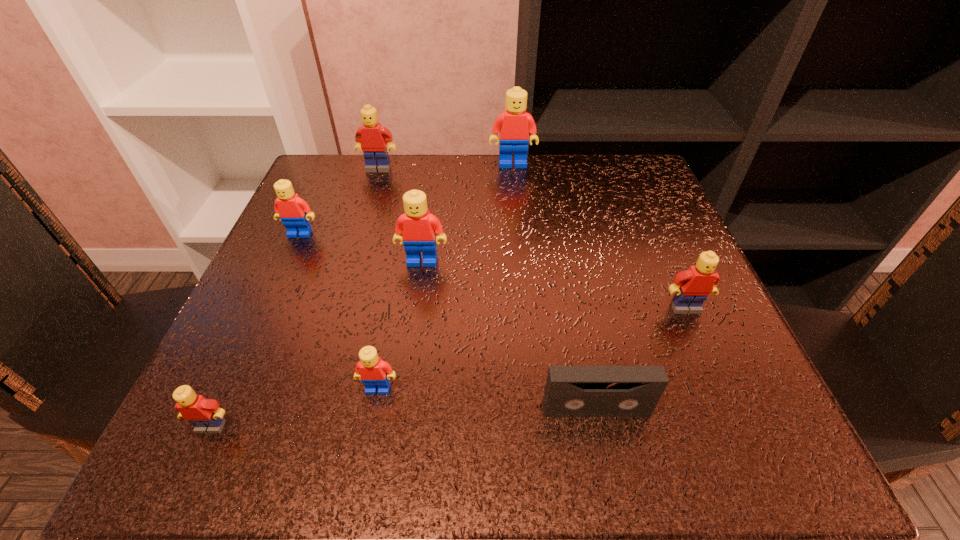
The image size is (960, 540). Find the location of `vacant region located on the face of the sixth farthest Lego`. vacant region located on the face of the sixth farthest Lego is located at coordinates (369, 438).

Identify the location of Lego situated at the near edge. This screenshot has height=540, width=960. (206, 415).

Where is `videotape positioned at the near edge`? This screenshot has height=540, width=960. videotape positioned at the near edge is located at coordinates (571, 391).

Identify the location of Lego positioned at the right edge. [693, 286].

The image size is (960, 540). I want to click on videotape located at the right edge, so click(x=571, y=391).

At what (x,y) coordinates should I click in order to perform the action: click on object that is at the far left corner. Please return your answer as a coordinate pair (x, y). The width and height of the screenshot is (960, 540). Looking at the image, I should click on (372, 138).

This screenshot has height=540, width=960. What are the coordinates of `object at the near left corner` in the screenshot? It's located at (206, 415).

This screenshot has width=960, height=540. Find the location of `object that is at the near right corner`. object that is at the near right corner is located at coordinates (571, 391).

In the image, there is a desktop. Where is `vacant region at the far edge`? This screenshot has width=960, height=540. vacant region at the far edge is located at coordinates (420, 185).

Locate an element on the screen. This screenshot has width=960, height=540. free space at the left edge is located at coordinates coord(284,311).